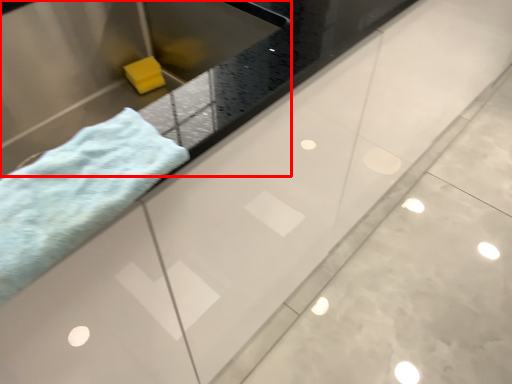
Question: In this image, where is sink (annotated by the red box) located relative to towel?

Choices:
 (A) right
 (B) left

Answer: (B)